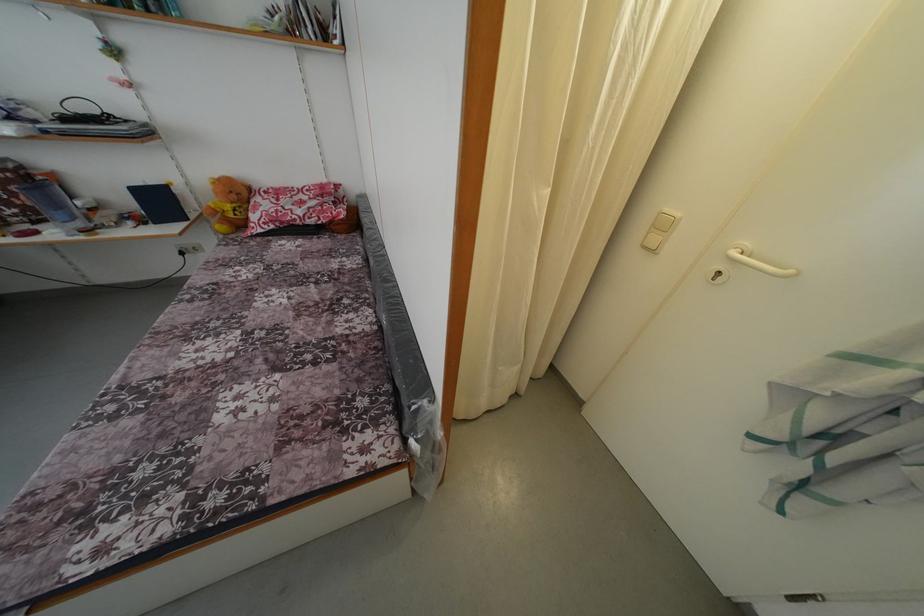
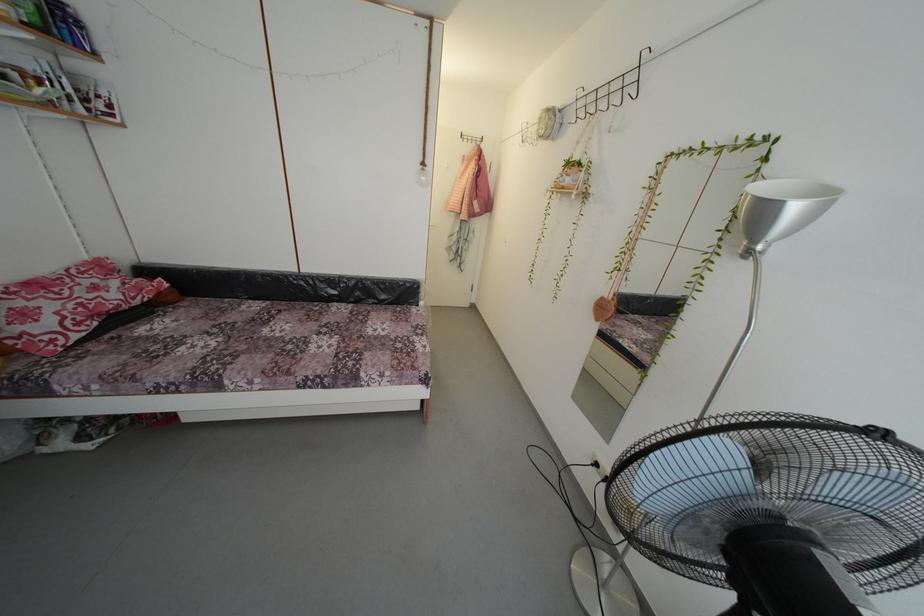
Locate, in the second image, the point that corresponds to point 256,282 in the first image.

(225, 345)